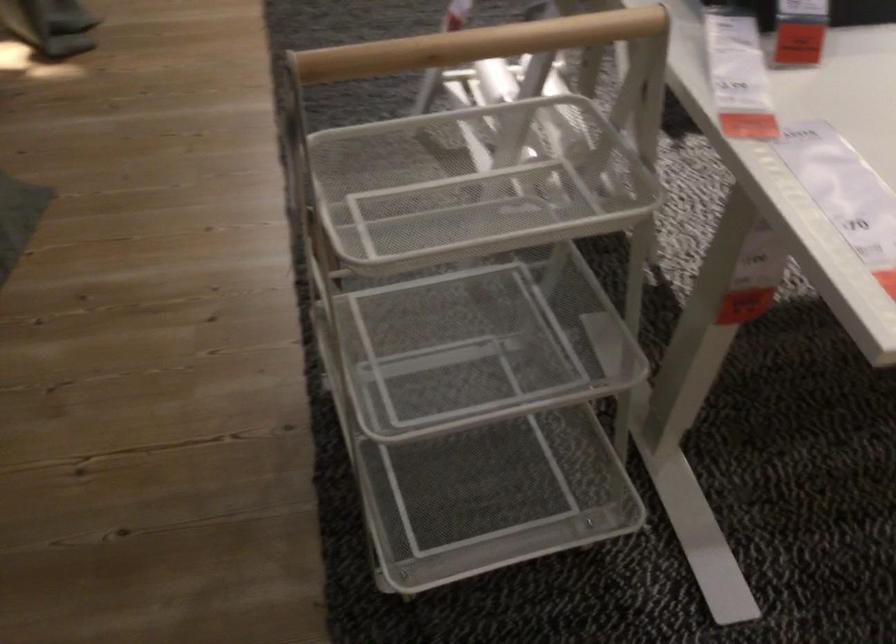
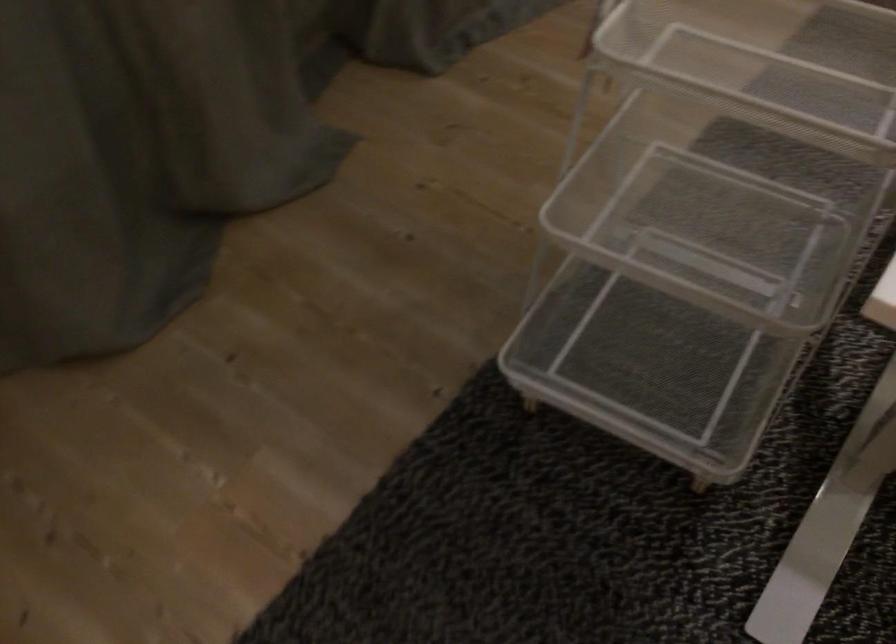
Where in the second image is the point corresponding to (x=478, y=486) from the first image?

(651, 361)